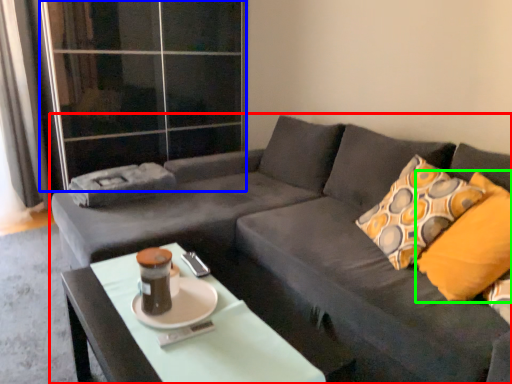
Question: Based on their relative distances, which object is nearer to studio couch (highlighted by a red box)? Choose from glass door (highlighted by a blue box) and throw pillow (highlighted by a green box).

Choices:
 (A) glass door
 (B) throw pillow

Answer: (B)